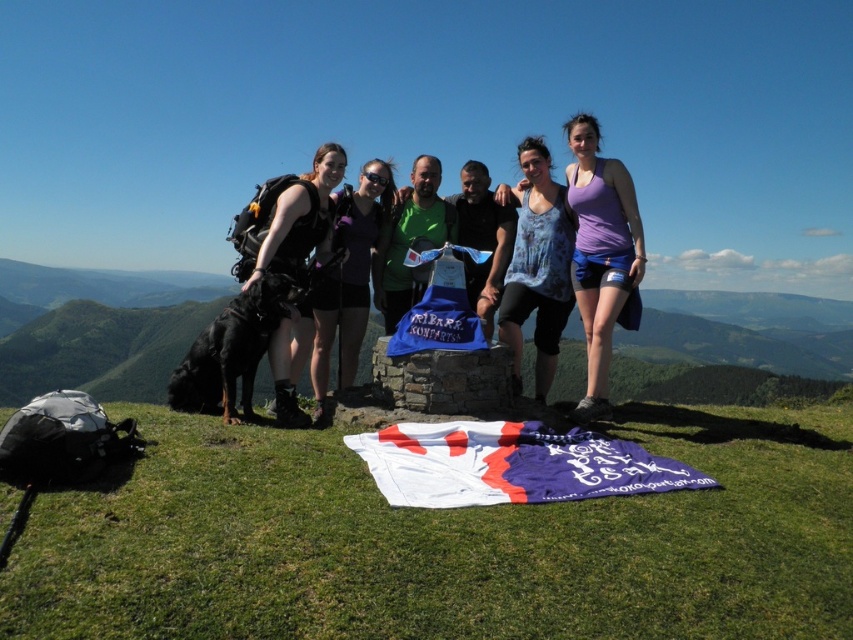
You are a photographer trying to capture the group photo of the six individuals on the grassy hill. You notice two fabrics at the center of the scene. Which fabric should you focus on first if you want to ensure the purple fabric at center is included in the frame before the blue fabric at center?

The purple fabric at center is to the right of the blue fabric at center, so you should focus on the blue fabric at center first to ensure the purple fabric at center is included in the frame before the blue one.